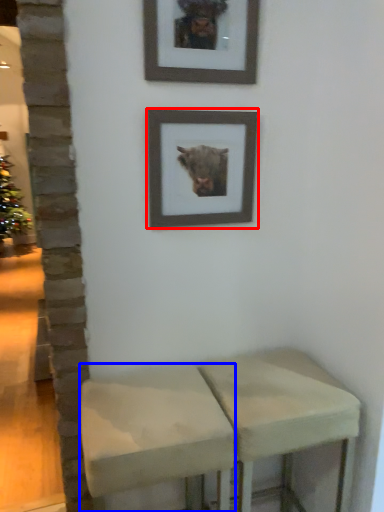
Question: Which of the following is the farthest to the observer, picture frame (highlighted by a red box) or stool (highlighted by a blue box)?

Choices:
 (A) picture frame
 (B) stool

Answer: (A)